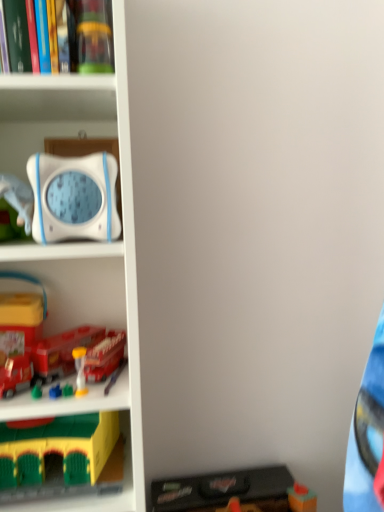
Question: Does hardcover book at upper left appear on the left side of black plastic toy at lower right, marked as the 1th toy in a right-to-left arrangement?

Choices:
 (A) no
 (B) yes

Answer: (B)

Question: Is hardcover book at upper left next to black plastic toy at lower right, which is counted as the first toy, starting from the bottom, and touching it?

Choices:
 (A) yes
 (B) no

Answer: (B)

Question: Can you confirm if hardcover book at upper left is taller than black plastic toy at lower right, the fourth toy viewed from the top?

Choices:
 (A) no
 (B) yes

Answer: (B)

Question: From the image's perspective, is hardcover book at upper left above black plastic toy at lower right, the 4th toy viewed from the left?

Choices:
 (A) no
 (B) yes

Answer: (B)

Question: From a real-world perspective, is hardcover book at upper left over black plastic toy at lower right, the fourth toy viewed from the top?

Choices:
 (A) yes
 (B) no

Answer: (A)

Question: Considering the relative positions of hardcover book at upper left and black plastic toy at lower right, which is counted as the first toy, starting from the bottom, in the image provided, is hardcover book at upper left in front of black plastic toy at lower right, which is counted as the first toy, starting from the bottom,?

Choices:
 (A) no
 (B) yes

Answer: (B)

Question: Can you confirm if translucent plastic hourglass at lower left, the 2th toy viewed from the top, is wider than white plastic bookcase at left?

Choices:
 (A) yes
 (B) no

Answer: (B)

Question: Is translucent plastic hourglass at lower left, the 2th toy viewed from the top, closer to the viewer compared to white plastic bookcase at left?

Choices:
 (A) no
 (B) yes

Answer: (A)

Question: Is translucent plastic hourglass at lower left, which appears as the 3th toy when viewed from the right, completely or partially outside of white plastic bookcase at left?

Choices:
 (A) no
 (B) yes

Answer: (A)

Question: Is translucent plastic hourglass at lower left, the 2th toy viewed from the top, bigger than white plastic bookcase at left?

Choices:
 (A) yes
 (B) no

Answer: (B)

Question: Is translucent plastic hourglass at lower left, which appears as the 3th toy when viewed from the right, facing towards white plastic bookcase at left?

Choices:
 (A) no
 (B) yes

Answer: (B)

Question: From the image's perspective, does translucent plastic hourglass at lower left, marked as the 2th toy in a left-to-right arrangement, appear higher than white plastic bookcase at left?

Choices:
 (A) no
 (B) yes

Answer: (A)

Question: Considering the relative positions of white plastic bookcase at left and hardcover book at upper left in the image provided, is white plastic bookcase at left to the right of hardcover book at upper left from the viewer's perspective?

Choices:
 (A) yes
 (B) no

Answer: (B)